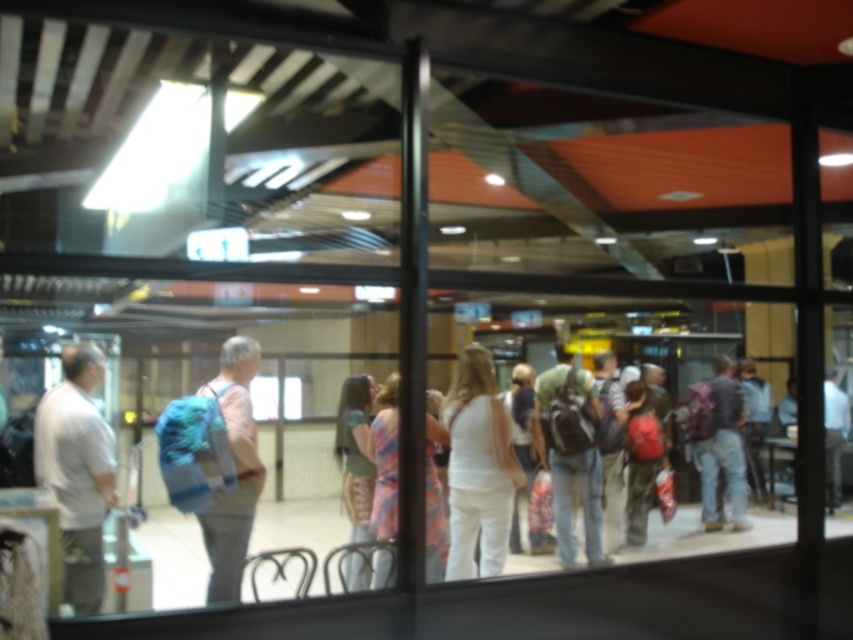
Can you confirm if light brown fabric dress at center is positioned to the right of plaid fabric dress at center?

Incorrect, light brown fabric dress at center is not on the right side of plaid fabric dress at center.

Between light brown fabric dress at center and plaid fabric dress at center, which one appears on the left side from the viewer's perspective?

light brown fabric dress at center

Which is behind, point (347, 460) or point (383, 525)?

Positioned behind is point (347, 460).

Where is `light brown fabric dress at center`? light brown fabric dress at center is located at coordinates (355, 451).

Which is more to the right, matte gray backpack at center or denim pants at center?

From the viewer's perspective, denim pants at center appears more on the right side.

Is the position of matte gray backpack at center less distant than that of denim pants at center?

That is True.

Does point (538, 404) come behind point (831, 404)?

No.

I want to click on matte gray backpack at center, so click(570, 461).

Who is lower down, blue backpack at center or matte purple backpack at center?

Positioned lower is matte purple backpack at center.

Is point (229, 428) closer to camera compared to point (738, 452)?

Yes, it is in front of point (738, 452).

Identify the location of blue backpack at center. Image resolution: width=853 pixels, height=640 pixels. (x=236, y=470).